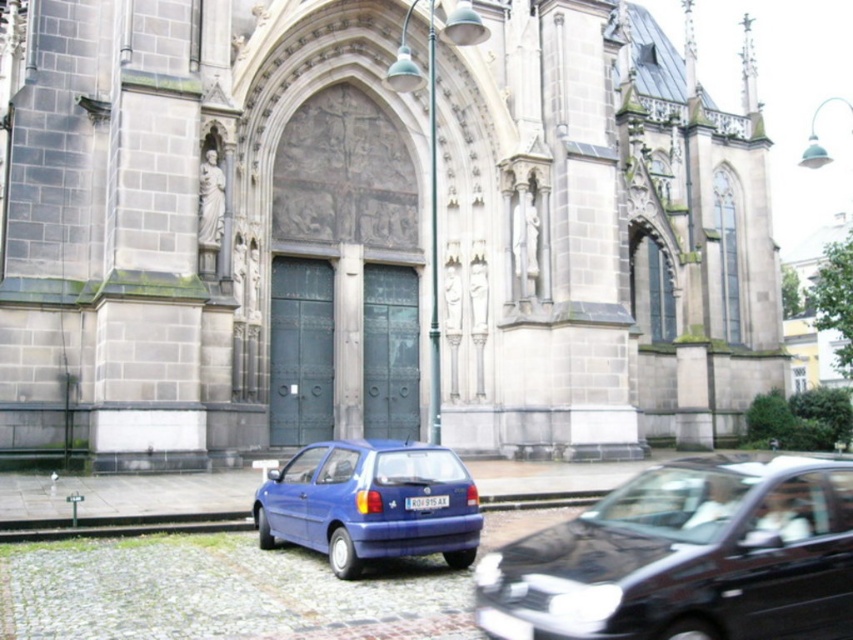
Question: Which object is the closest to the white plastic license plate at center?

Choices:
 (A) gray stone church at center
 (B) matte blue hatchback at lower left
 (C) blue matte hatchback at lower center

Answer: (C)

Question: Is gray stone church at center smaller than blue matte hatchback at lower center?

Choices:
 (A) no
 (B) yes

Answer: (A)

Question: Is gray stone church at center closer to the viewer compared to matte blue hatchback at lower left?

Choices:
 (A) yes
 (B) no

Answer: (B)

Question: Considering the real-world distances, which object is closest to the blue matte hatchback at lower center?

Choices:
 (A) matte blue hatchback at lower left
 (B) gray stone church at center

Answer: (A)

Question: Where is matte blue hatchback at lower left located in relation to white plastic license plate at center in the image?

Choices:
 (A) above
 (B) below

Answer: (B)

Question: Which is farther from the blue matte hatchback at lower center?

Choices:
 (A) gray stone church at center
 (B) white plastic license plate at center
 (C) matte blue hatchback at lower left

Answer: (A)